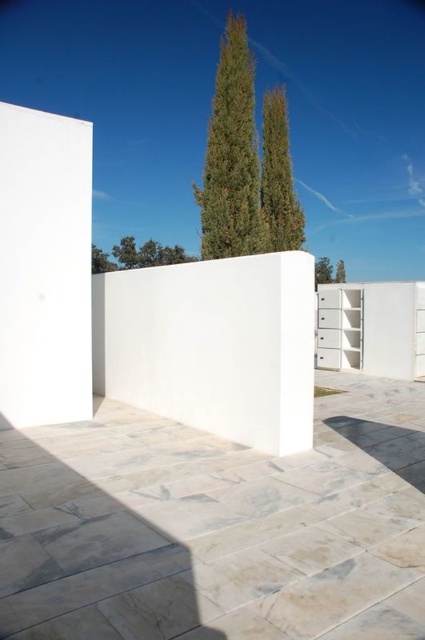
Does green textured cypress tree at upper center have a larger size compared to green leafy cypress at upper center?

Indeed, green textured cypress tree at upper center has a larger size compared to green leafy cypress at upper center.

Can you confirm if green textured cypress tree at upper center is taller than green leafy cypress at upper center?

Yes, green textured cypress tree at upper center is taller than green leafy cypress at upper center.

What do you see at coordinates (232, 156) in the screenshot? I see `green textured cypress tree at upper center` at bounding box center [232, 156].

Locate an element on the screen. Image resolution: width=425 pixels, height=640 pixels. green textured cypress tree at upper center is located at coordinates tap(232, 156).